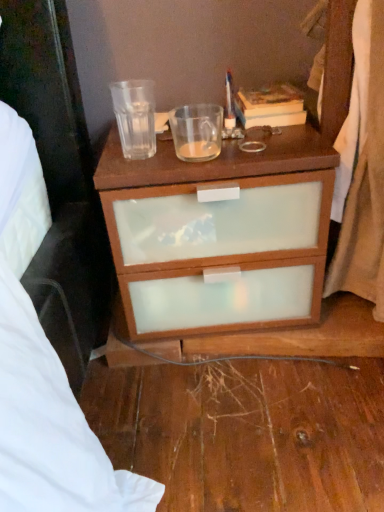
Question: Which direction should I rotate to look at translucent glass coffee cup at upper center, which appears as the 1th coffee cup when viewed from the right, — up or down?

Choices:
 (A) up
 (B) down

Answer: (A)

Question: Does transparent glass at upper center, the 1th coffee cup from the left, have a larger size compared to hardcover book at upper right?

Choices:
 (A) no
 (B) yes

Answer: (A)

Question: Can you confirm if transparent glass at upper center, the 1th coffee cup from the left, is positioned to the right of hardcover book at upper right?

Choices:
 (A) no
 (B) yes

Answer: (A)

Question: Is transparent glass at upper center, marked as the 2th coffee cup in a right-to-left arrangement, to the left of hardcover book at upper right from the viewer's perspective?

Choices:
 (A) no
 (B) yes

Answer: (B)

Question: Is transparent glass at upper center, the 1th coffee cup from the left, oriented towards hardcover book at upper right?

Choices:
 (A) yes
 (B) no

Answer: (B)

Question: Is transparent glass at upper center, the 1th coffee cup from the left, far away from hardcover book at upper right?

Choices:
 (A) yes
 (B) no

Answer: (B)

Question: Can you see transparent glass at upper center, the 1th coffee cup from the left, touching hardcover book at upper right?

Choices:
 (A) no
 (B) yes

Answer: (A)

Question: From the image's perspective, is transparent glass at upper center, the 1th coffee cup from the left, above translucent glass coffee cup at upper center, which appears as the 1th coffee cup when viewed from the right?

Choices:
 (A) yes
 (B) no

Answer: (A)

Question: From a real-world perspective, does transparent glass at upper center, the 1th coffee cup from the left, stand above translucent glass coffee cup at upper center, marked as the second coffee cup in a left-to-right arrangement?

Choices:
 (A) no
 (B) yes

Answer: (B)

Question: Is transparent glass at upper center, marked as the 2th coffee cup in a right-to-left arrangement, closer to camera compared to translucent glass coffee cup at upper center, which appears as the 1th coffee cup when viewed from the right?

Choices:
 (A) no
 (B) yes

Answer: (B)

Question: Is transparent glass at upper center, the 1th coffee cup from the left, smaller than translucent glass coffee cup at upper center, marked as the second coffee cup in a left-to-right arrangement?

Choices:
 (A) yes
 (B) no

Answer: (B)

Question: Is transparent glass at upper center, marked as the 2th coffee cup in a right-to-left arrangement, placed right next to translucent glass coffee cup at upper center, which appears as the 1th coffee cup when viewed from the right?

Choices:
 (A) yes
 (B) no

Answer: (A)

Question: Is translucent glass coffee cup at upper center, marked as the second coffee cup in a left-to-right arrangement, a part of transparent glass at upper center, the 1th coffee cup from the left?

Choices:
 (A) yes
 (B) no

Answer: (B)

Question: Does white fabric curtain at right lie behind hardcover book at upper right?

Choices:
 (A) yes
 (B) no

Answer: (B)